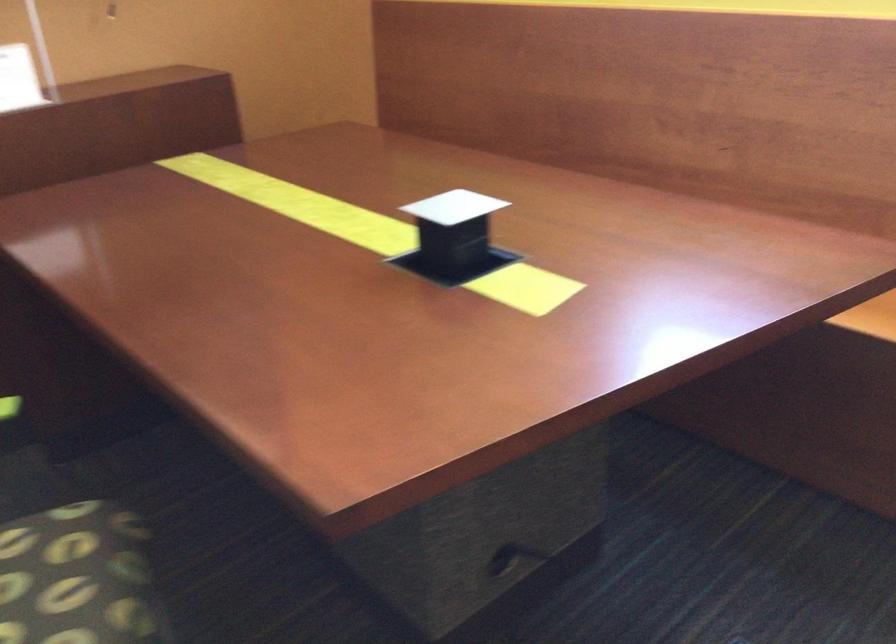
Describe the element at coordinates (74, 576) in the screenshot. I see `a sofa sitting surface` at that location.